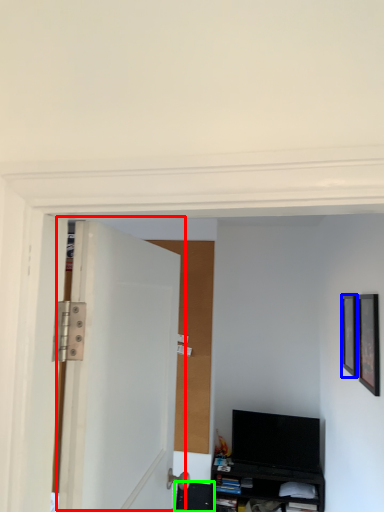
Question: Which is nearer to the door (highlighted by a red box)? picture frame (highlighted by a blue box) or shelf (highlighted by a green box).

Choices:
 (A) picture frame
 (B) shelf

Answer: (A)